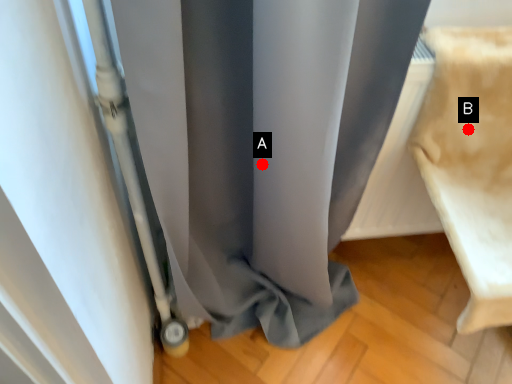
Question: Two points are circled on the image, labeled by A and B beside each circle. Which point appears farthest from the camera in this image?

Choices:
 (A) A is further
 (B) B is further

Answer: (B)